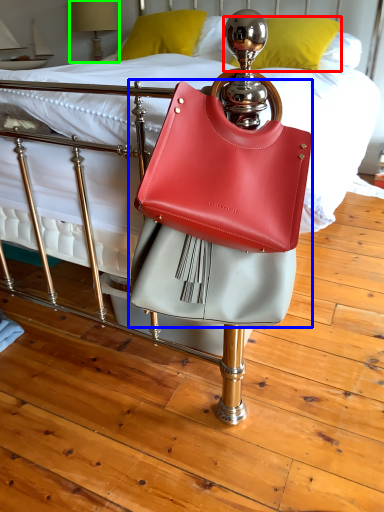
Question: Which object is the closest to the pillow (highlighted by a red box)? Choose among these: handbag (highlighted by a blue box) or table lamp (highlighted by a green box).

Choices:
 (A) handbag
 (B) table lamp

Answer: (B)